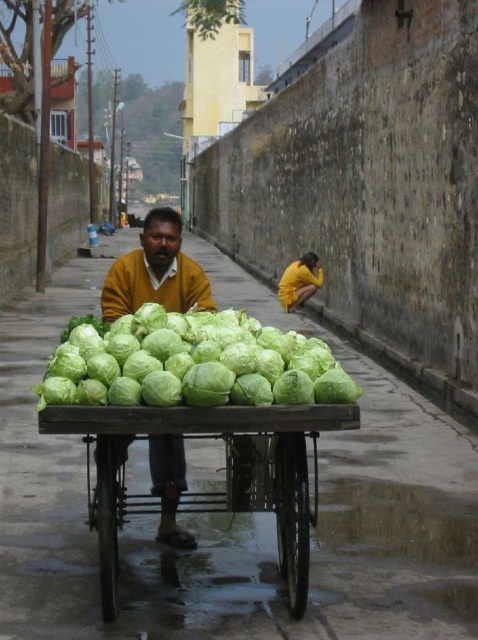
Does green leafy cabbage at center have a lesser width compared to yellow sweater at center?

Yes.

Is green leafy cabbage at center wider than yellow sweater at center?

No, green leafy cabbage at center is not wider than yellow sweater at center.

Locate an element on the screen. The height and width of the screenshot is (640, 478). green leafy cabbage at center is located at coordinates (193, 364).

Locate an element on the screen. The height and width of the screenshot is (640, 478). green leafy cabbage at center is located at coordinates 193,364.

Is wooden cart at center to the right of green leafy cabbage at center from the viewer's perspective?

Indeed, wooden cart at center is positioned on the right side of green leafy cabbage at center.

Does wooden cart at center have a lesser width compared to green leafy cabbage at center?

Correct, wooden cart at center's width is less than green leafy cabbage at center's.

Which is behind, point (117, 477) or point (74, 342)?

The point (117, 477) is behind.

Where is `wooden cart at center`? The width and height of the screenshot is (478, 640). wooden cart at center is located at coordinates tap(225, 472).

Looking at this image, which of these two, wooden cart at center or yellow sweater at center, stands shorter?

wooden cart at center

Which of these two, wooden cart at center or yellow sweater at center, stands taller?

yellow sweater at center

The width and height of the screenshot is (478, 640). Find the location of `wooden cart at center`. wooden cart at center is located at coordinates (225, 472).

In order to click on wooden cart at center in this screenshot , I will do `click(225, 472)`.